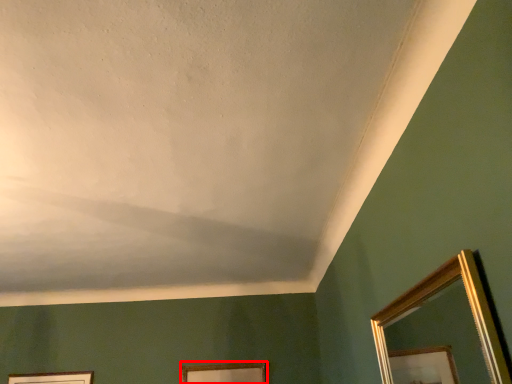
Question: From the image, what is the correct spatial relationship of picture frame (annotated by the red box) in relation to mirror?

Choices:
 (A) left
 (B) right

Answer: (A)